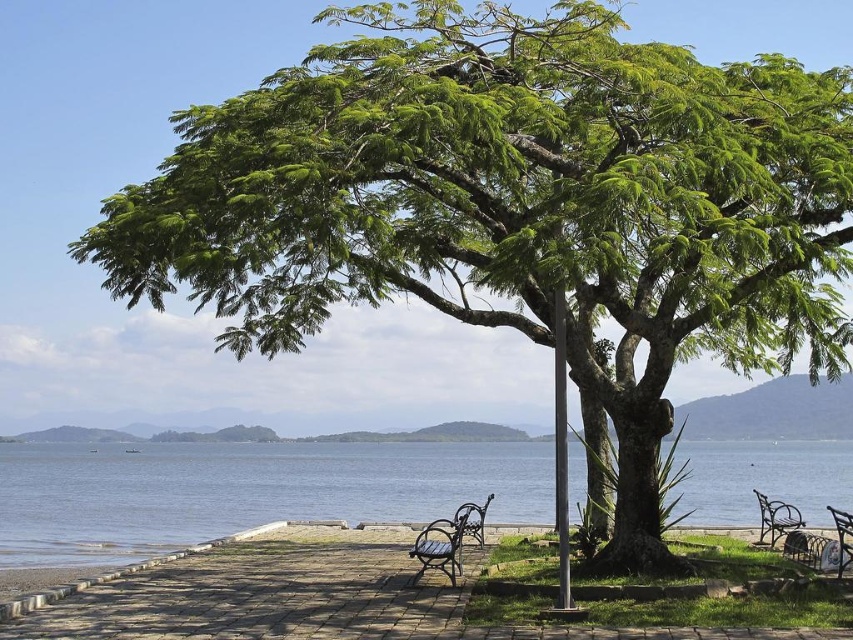
You are planning to place a new bench that is the same size as the wooden bench at center along the walkway. Based on the scene, can the blue water at lower center accommodate the bench without overlapping? Explain your reasoning.

The blue water at lower center has a larger width than the wooden bench at center. Since the water is wider, there is sufficient space to place the bench without overlapping.

You are planning to place a new decorative statue that is 1.2 meters tall in the lakeside area. Considering the blue water at lower center and the bronze textured bench at center, which object would allow the statue to be placed without blocking the view of the other object? Please explain your reasoning.

The blue water at lower center is larger in size than the bronze textured bench at center. Since the statue is 1.2 meters tall, placing it near the larger blue water at lower center would provide enough space to avoid blocking the view of the smaller bronze textured bench at center.